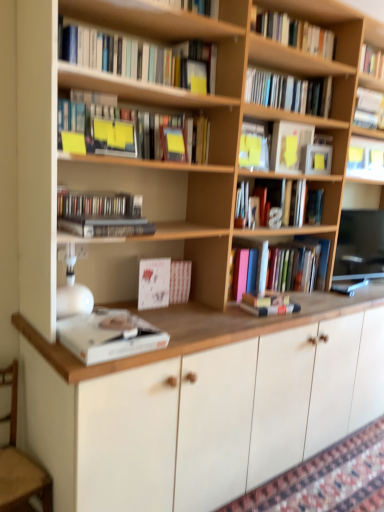
At what (x,y) coordinates should I click in order to perform the action: click on free space in front of white textured book at center, the third book positioned from the bottom. Please return your answer as a coordinate pair (x, y). The width and height of the screenshot is (384, 512). Looking at the image, I should click on (166, 312).